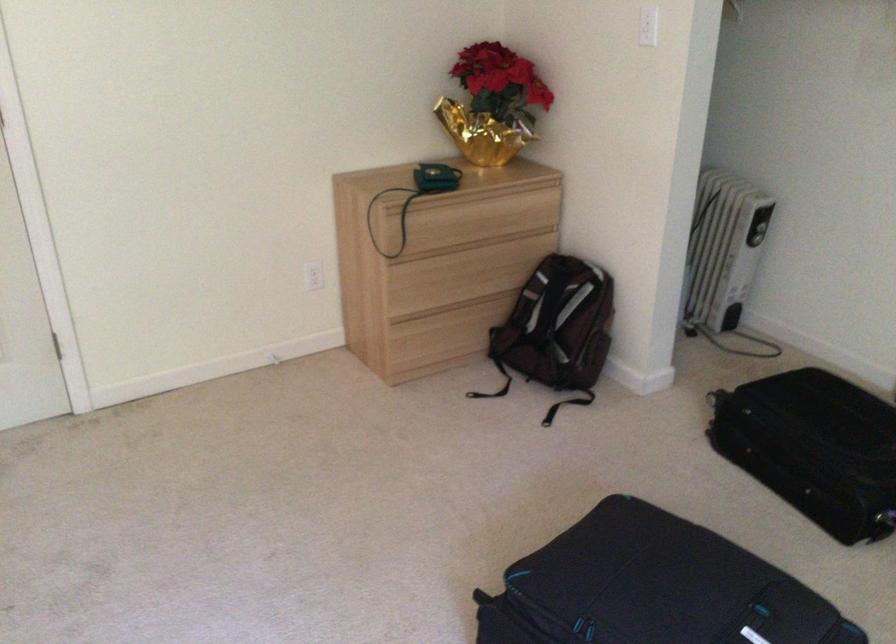
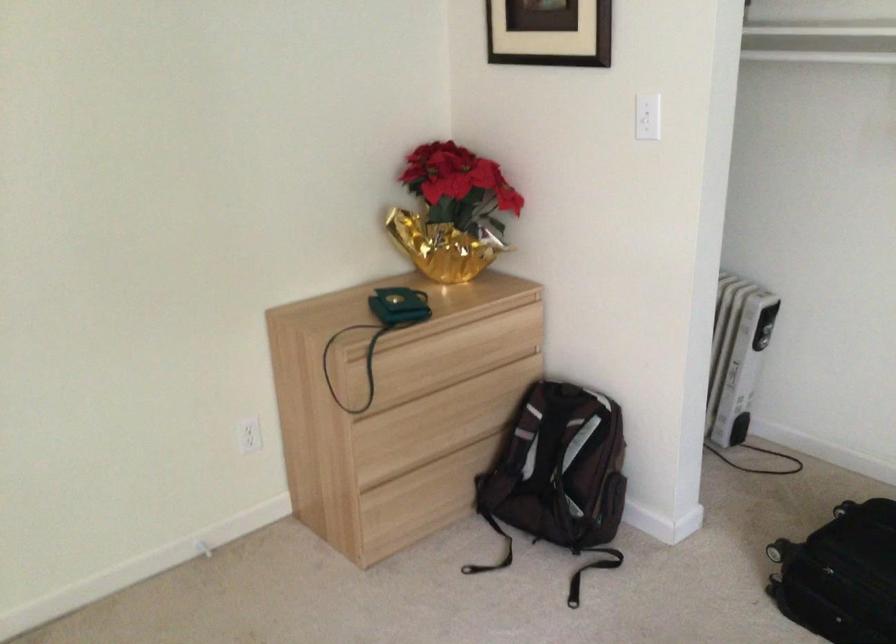
Question: The first image is from the beginning of the video and the second image is from the end. How did the camera likely rotate when shooting the video?

Choices:
 (A) Left
 (B) Right
 (C) Up
 (D) Down

Answer: (B)